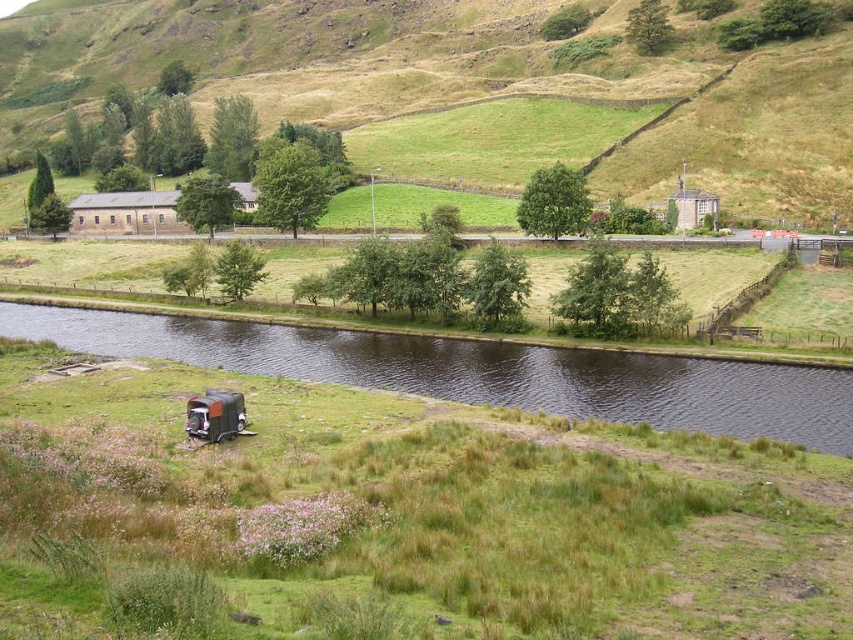
Does green grassy field at lower center appear on the left side of dark brown water at center?

Incorrect, green grassy field at lower center is not on the left side of dark brown water at center.

What do you see at coordinates (399, 518) in the screenshot? I see `green grassy field at lower center` at bounding box center [399, 518].

Image resolution: width=853 pixels, height=640 pixels. I want to click on green grassy field at lower center, so click(399, 518).

Which is more to the right, green grassy hillside at upper center or dark brown water at center?

dark brown water at center is more to the right.

Is the position of green grassy hillside at upper center more distant than that of dark brown water at center?

Yes.

Which is in front, point (26, 26) or point (833, 438)?

Point (833, 438) is in front.

Image resolution: width=853 pixels, height=640 pixels. I want to click on green grassy hillside at upper center, so click(x=367, y=74).

Does green grassy field at lower center have a greater width compared to green grassy hillside at upper center?

In fact, green grassy field at lower center might be narrower than green grassy hillside at upper center.

Is green grassy field at lower center behind green grassy hillside at upper center?

No, it is in front of green grassy hillside at upper center.

Locate an element on the screen. Image resolution: width=853 pixels, height=640 pixels. green grassy field at lower center is located at coordinates (399, 518).